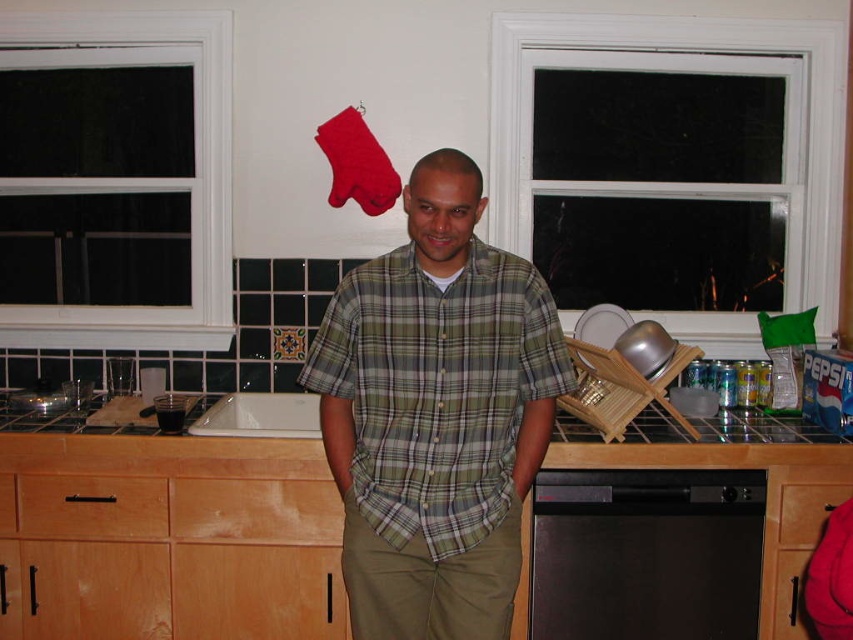
Question: Can you confirm if light brown wood drawer at lower center is thinner than beech wood drawer at lower left?

Choices:
 (A) yes
 (B) no

Answer: (B)

Question: Among these objects, which one is nearest to the camera?

Choices:
 (A) green plaid shirt at center
 (B) beech wood drawer at lower left
 (C) black matte dishwasher at lower center
 (D) light brown wood drawer at lower center

Answer: (A)

Question: Is green plaid shirt at center closer to camera compared to black matte dishwasher at lower center?

Choices:
 (A) yes
 (B) no

Answer: (A)

Question: Is wooden at center wider than satin wood drawer at center?

Choices:
 (A) yes
 (B) no

Answer: (A)

Question: Which point appears closest to the camera in this image?

Choices:
 (A) (39, 522)
 (B) (206, 497)

Answer: (B)

Question: Estimate the real-world distances between objects in this image. Which object is farther from the beech wood drawer at lower left?

Choices:
 (A) white glossy sink at center
 (B) satin wood drawer at center
 (C) black matte dishwasher at lower center

Answer: (B)